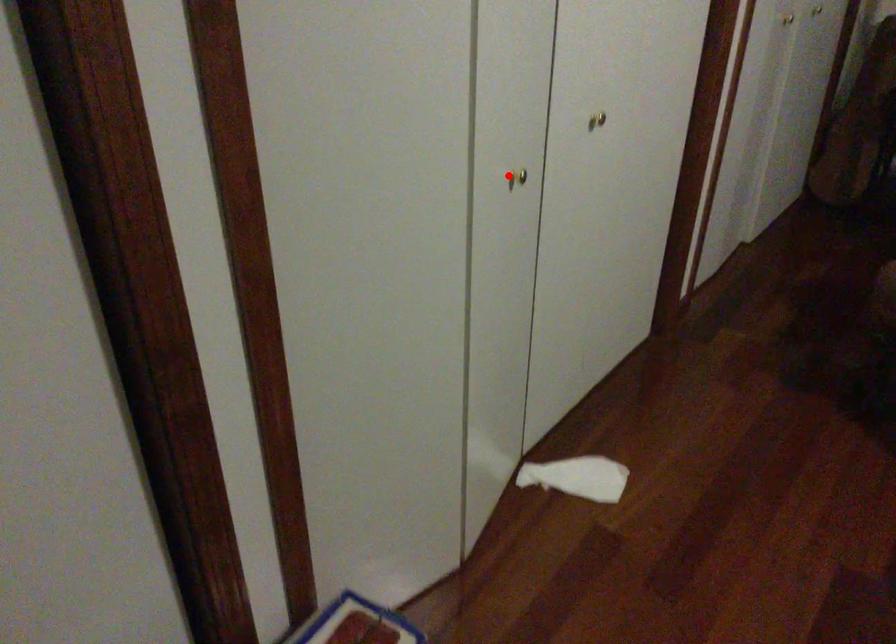
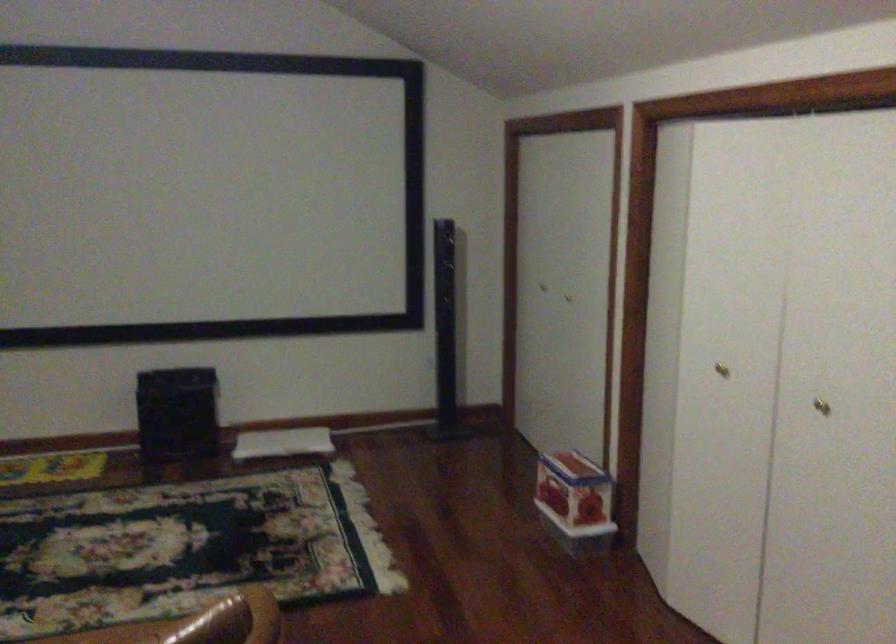
Question: A red point is marked in image1. In image2, is the corresponding 3D point closer to the camera or farther? Reply with the corresponding letter.

Choices:
 (A) The corresponding 3D point is closer.
 (B) The corresponding 3D point is farther.

Answer: (B)